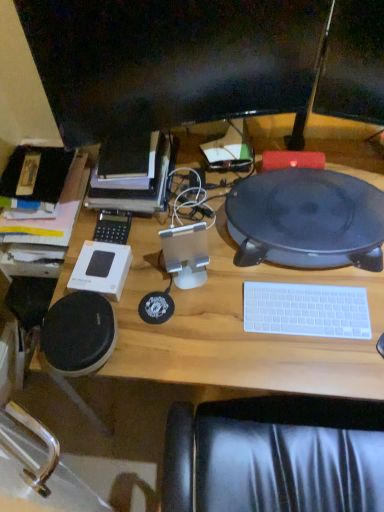
Find the location of a particular element. free space in front of white plastic keyboard at lower right is located at coordinates (314, 360).